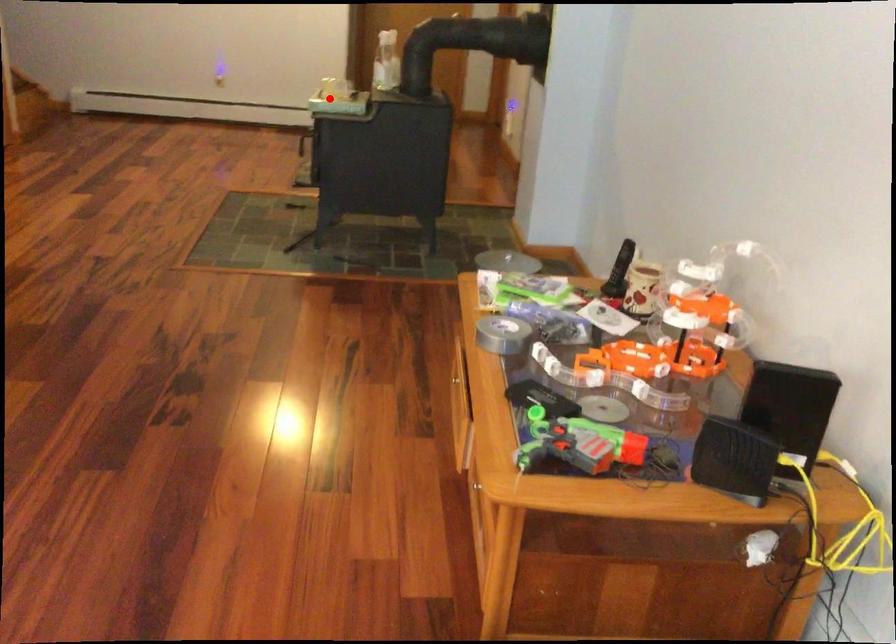
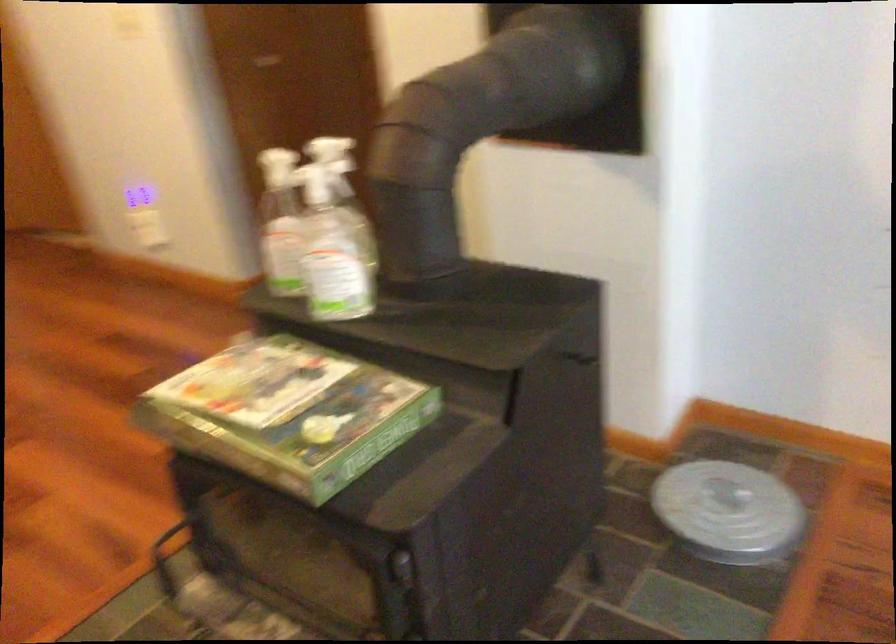
Question: I am providing you with two images of the same scene from different viewpoints. A red point is shown in image1. For the corresponding object point in image2, is it positioned nearer or farther from the camera?

Choices:
 (A) Nearer
 (B) Farther

Answer: (A)